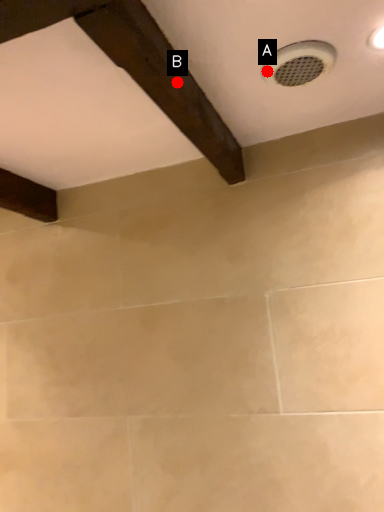
Question: Two points are circled on the image, labeled by A and B beside each circle. Which point is further to the camera?

Choices:
 (A) A is further
 (B) B is further

Answer: (A)